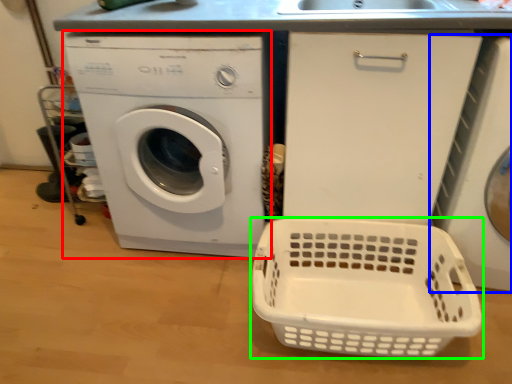
Question: Estimate the real-world distances between objects in this image. Which object is farther from washing machine (highlighted by a red box), washing machine (highlighted by a blue box) or basket (highlighted by a green box)?

Choices:
 (A) washing machine
 (B) basket

Answer: (A)